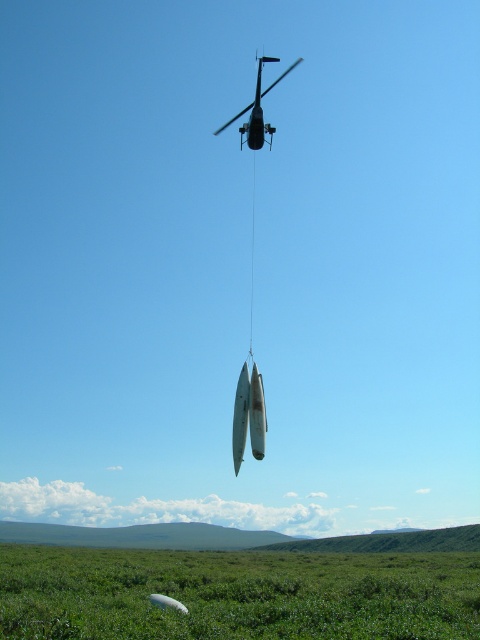
You are a pilot flying the metallic silver helicopter at upper center and need to land it safely. Considering the green grassy field at lower center, will the helicopter be able to land there?

The green grassy field at lower center is shorter than the metallic silver helicopter at upper center, so the helicopter cannot land there as the field is not tall enough to accommodate it.

You are a pilot flying the metallic silver helicopter at upper center. You need to land it safely in the green grassy field at lower center. Is the helicopter currently positioned above the landing area?

Yes, the metallic silver helicopter at upper center is positioned above the green grassy field at lower center, so it can land safely there.